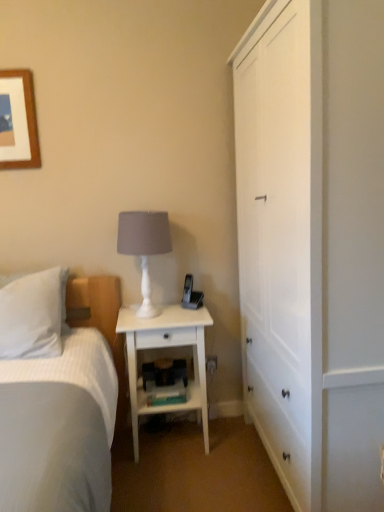
Describe the element at coordinates (166, 347) in the screenshot. I see `white wood nightstand at center` at that location.

The image size is (384, 512). What are the coordinates of `white plastic electric outlet at lower center` in the screenshot? It's located at (211, 364).

In order to face white plastic electric outlet at lower center, should I rotate leftwards or rightwards?

Turn right by 2.855 degrees to look at white plastic electric outlet at lower center.

The height and width of the screenshot is (512, 384). I want to click on white wood cabinet at right, so click(x=314, y=246).

What do you see at coordinates (314, 246) in the screenshot?
I see `white wood cabinet at right` at bounding box center [314, 246].

The width and height of the screenshot is (384, 512). Describe the element at coordinates (144, 247) in the screenshot. I see `white matte table lamp at center` at that location.

I want to click on white soft pillow at left, so click(33, 315).

Identify the location of white wood nightstand at center. (166, 347).

From a real-world perspective, which is physically above, white wood cabinet at right or white soft pillow at left?

white wood cabinet at right.

You are a GUI agent. You are given a task and a screenshot of the screen. Output one action in this format:
    pyautogui.click(x=<x>, y=<y>)
    Task: Click on the cabinetry above the white soft pillow at left (from the image's perspective)
    Image resolution: width=384 pixels, height=512 pixels.
    Given the screenshot: What is the action you would take?
    pyautogui.click(x=314, y=246)

Considering the sizes of white wood cabinet at right and white soft pillow at left in the image, is white wood cabinet at right bigger or smaller than white soft pillow at left?

In the image, white wood cabinet at right appears to be larger than white soft pillow at left.

From the image's perspective, is white wood cabinet at right below white soft pillow at left?

No, from the image's perspective, white wood cabinet at right is not beneath white soft pillow at left.

From a real-world perspective, is white soft pillow at left physically above white wood cabinet at right?

No, from a real-world perspective, white soft pillow at left is not above white wood cabinet at right.

Considering the positions of objects white soft pillow at left and white wood cabinet at right in the image provided, who is more to the right, white soft pillow at left or white wood cabinet at right?

From the viewer's perspective, white wood cabinet at right appears more on the right side.

Which is behind, point (60, 272) or point (256, 46)?

The point (60, 272) is farther from the camera.

Find the location of a particular element. This screenshot has height=512, width=384. cabinetry located above the white soft pillow at left (from the image's perspective) is located at coordinates (314, 246).

Looking at their sizes, would you say white soft pillow at left is wider or thinner than white wood nightstand at center?

Considering their sizes, white soft pillow at left looks slimmer than white wood nightstand at center.

How different are the orientations of white soft pillow at left and white wood nightstand at center in degrees?

0.514 degrees.

Is white soft pillow at left shorter than white wood nightstand at center?

Indeed, white soft pillow at left has a lesser height compared to white wood nightstand at center.

Is white soft pillow at left to the left of white wood nightstand at center from the viewer's perspective?

Yes.

Between white wood nightstand at center and white plastic electric outlet at lower center, which one has larger width?

white wood nightstand at center.

Which is farther, [167,315] or [213,365]?

The point [213,365] is behind.

Who is more distant, white wood nightstand at center or white plastic electric outlet at lower center?

Positioned behind is white plastic electric outlet at lower center.

From the image's perspective, is white wood nightstand at center beneath white plastic electric outlet at lower center?

No.

Is white soft pillow at left facing towards white matte table lamp at center?

No, white soft pillow at left does not turn towards white matte table lamp at center.

Considering the relative sizes of white soft pillow at left and white matte table lamp at center in the image provided, is white soft pillow at left shorter than white matte table lamp at center?

Correct, white soft pillow at left is not as tall as white matte table lamp at center.

Locate an element on the screen. This screenshot has width=384, height=512. table lamp on the right side of white soft pillow at left is located at coordinates (144, 247).

Considering the sizes of objects white soft pillow at left and white matte table lamp at center in the image provided, who is thinner, white soft pillow at left or white matte table lamp at center?

white matte table lamp at center.

Is white plastic electric outlet at lower center a part of white soft pillow at left?

No, white plastic electric outlet at lower center is located outside of white soft pillow at left.

Between white soft pillow at left and white plastic electric outlet at lower center, which one appears on the left side from the viewer's perspective?

white soft pillow at left is more to the left.

Find the location of a particular element. The height and width of the screenshot is (512, 384). electric outlet located on the right of white soft pillow at left is located at coordinates (211, 364).

Does white wood nightstand at center have a smaller size compared to white soft pillow at left?

Actually, white wood nightstand at center might be larger than white soft pillow at left.

Would you say white wood nightstand at center is a long distance from white soft pillow at left?

No, white wood nightstand at center is not far away from white soft pillow at left.

How different are the orientations of white wood nightstand at center and white soft pillow at left in degrees?

There is a 0.514-degree angle between the facing directions of white wood nightstand at center and white soft pillow at left.

What are the coordinates of `nightstand directly beneath the white soft pillow at left (from a real-world perspective)` in the screenshot? It's located at (166, 347).

Where is `cabinetry above the white soft pillow at left (from the image's perspective)`? The height and width of the screenshot is (512, 384). cabinetry above the white soft pillow at left (from the image's perspective) is located at coordinates (314, 246).

Where is `cabinetry located on the right of white soft pillow at left`? The height and width of the screenshot is (512, 384). cabinetry located on the right of white soft pillow at left is located at coordinates (314, 246).

From the image, which object appears to be farther from white plastic electric outlet at lower center, white matte table lamp at center or white soft pillow at left?

Based on the image, white soft pillow at left appears to be further to white plastic electric outlet at lower center.

Considering their positions, is white matte table lamp at center positioned further to white soft pillow at left than white plastic electric outlet at lower center?

Among the two, white plastic electric outlet at lower center is located further to white soft pillow at left.

Based on their spatial positions, is white wood nightstand at center or white wood cabinet at right closer to white matte table lamp at center?

Among the two, white wood nightstand at center is located nearer to white matte table lamp at center.

Based on the photo, looking at the image, which one is located further to white plastic electric outlet at lower center, white wood cabinet at right or white matte table lamp at center?

Based on the image, white wood cabinet at right appears to be further to white plastic electric outlet at lower center.

Based on their spatial positions, is white wood cabinet at right or white soft pillow at left further from white plastic electric outlet at lower center?

white wood cabinet at right is positioned further to the anchor white plastic electric outlet at lower center.

Looking at this image, estimate the real-world distances between objects in this image. Which object is closer to white matte table lamp at center, white wood nightstand at center or white plastic electric outlet at lower center?

white wood nightstand at center.

Which object lies further to the anchor point white soft pillow at left, white matte table lamp at center or white wood nightstand at center?

The object further to white soft pillow at left is white wood nightstand at center.

From the image, which object appears to be farther from white wood nightstand at center, white plastic electric outlet at lower center or white matte table lamp at center?

white plastic electric outlet at lower center lies further to white wood nightstand at center than the other object.

Image resolution: width=384 pixels, height=512 pixels. Identify the location of table lamp between white soft pillow at left and white plastic electric outlet at lower center in the horizontal direction. (144, 247).

You are a GUI agent. You are given a task and a screenshot of the screen. Output one action in this format:
    pyautogui.click(x=<x>, y=<y>)
    Task: Click on the nightstand between white soft pillow at left and white wood cabinet at right in the horizontal direction
    
    Given the screenshot: What is the action you would take?
    pyautogui.click(x=166, y=347)

This screenshot has height=512, width=384. Identify the location of nightstand positioned between white wood cabinet at right and white plastic electric outlet at lower center from near to far. [x=166, y=347].

Locate an element on the screen. This screenshot has height=512, width=384. electric outlet located between white soft pillow at left and white wood cabinet at right in the left-right direction is located at coordinates [x=211, y=364].